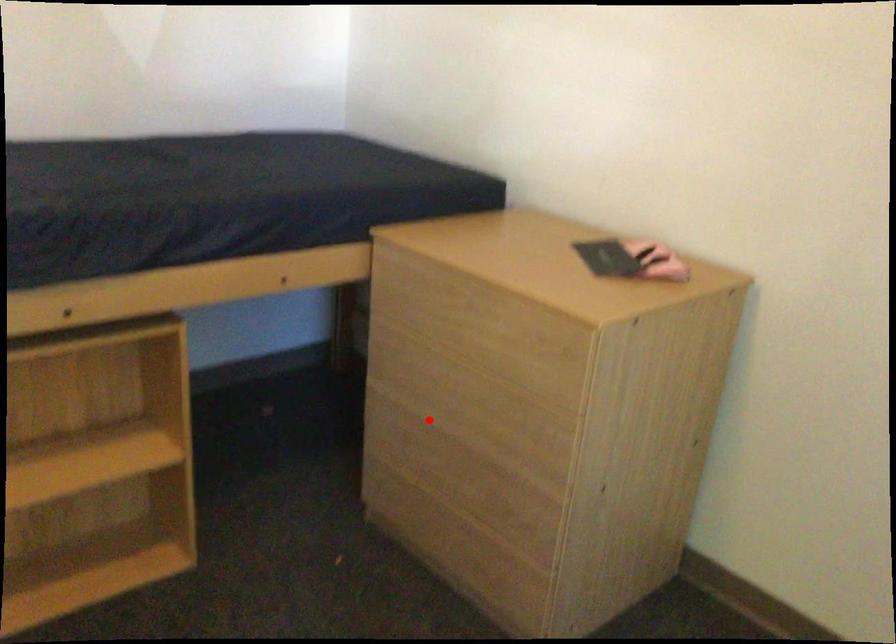
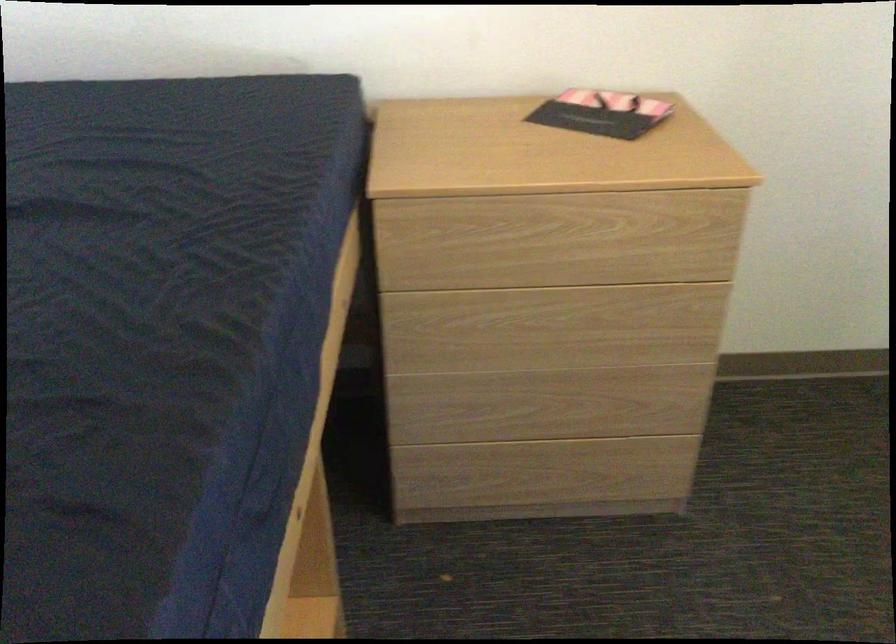
Question: I am providing you with two images of the same scene from different viewpoints. A red point is shown in image1. For the corresponding object point in image2, is it positioned nearer or farther from the camera?

Choices:
 (A) Nearer
 (B) Farther

Answer: (A)